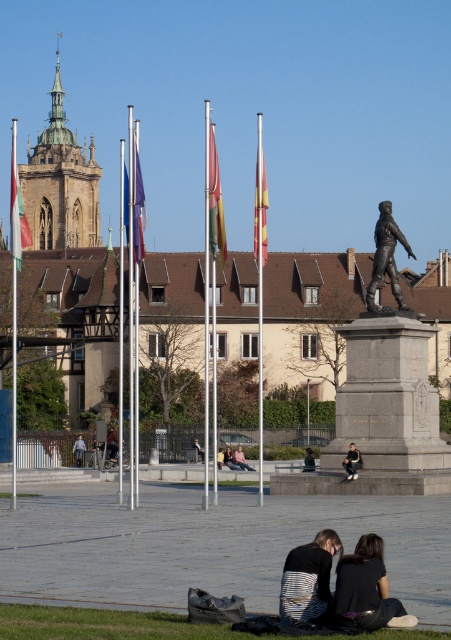
You are a photographer standing in the urban square and notice the striped fabric couple at lower center and the dark blue jeans at center. Which object is positioned higher in the image?

The striped fabric couple at lower center is located above the dark blue jeans at center, so it is positioned higher in the image.